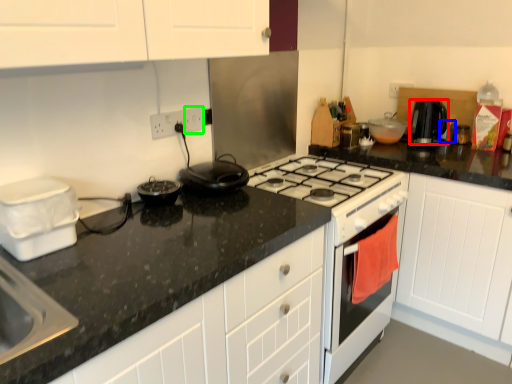
Question: Which is nearer to the kitchen appliance (highlighted by a red box)? appliance (highlighted by a blue box) or electric outlet (highlighted by a green box).

Choices:
 (A) appliance
 (B) electric outlet

Answer: (A)